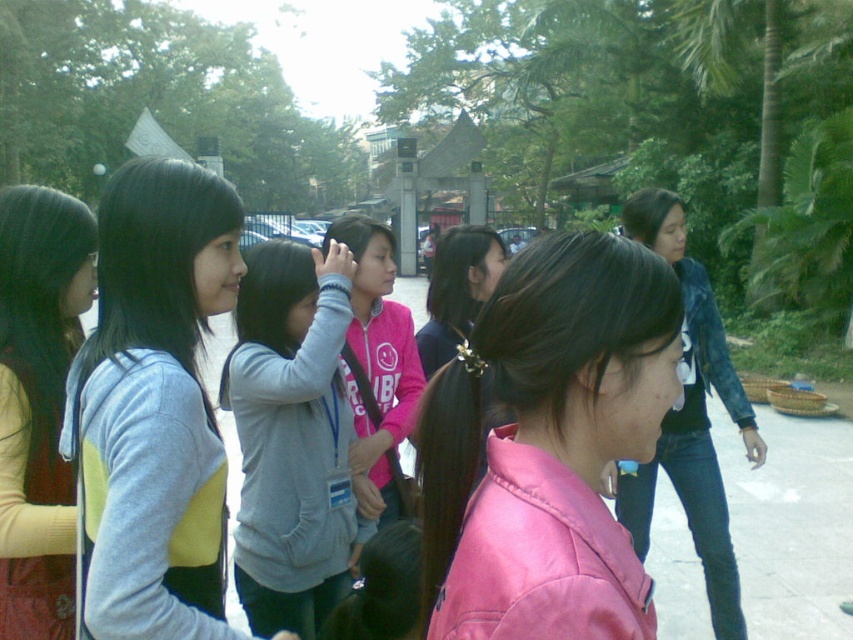
Question: Can you confirm if pink leather jacket at center is positioned below gray fleece jacket at center?

Choices:
 (A) yes
 (B) no

Answer: (B)

Question: Is pink leather jacket at center below light blue fleece jacket at left?

Choices:
 (A) yes
 (B) no

Answer: (A)

Question: Estimate the real-world distances between objects in this image. Which object is farther from the gray fleece jacket at center?

Choices:
 (A) matte yellow sweater at left
 (B) pink leather jacket at center
 (C) light blue fleece jacket at left

Answer: (B)

Question: Which point is closer to the camera?

Choices:
 (A) pink leather jacket at center
 (B) denim jacket at right
 (C) gray fleece jacket at center

Answer: (A)

Question: Is pink leather jacket at center positioned before matte yellow sweater at left?

Choices:
 (A) yes
 (B) no

Answer: (A)

Question: Which object appears closest to the camera in this image?

Choices:
 (A) pink leather jacket at center
 (B) light blue fleece jacket at left

Answer: (A)